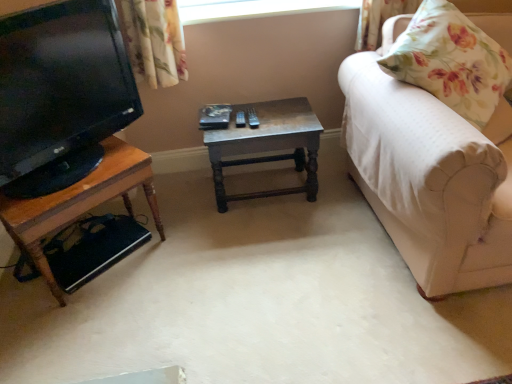
Where is `vacant space situated above woodenobject at left, arranged as the second table when viewed from the right (from a real-world perspective)`? The height and width of the screenshot is (384, 512). vacant space situated above woodenobject at left, arranged as the second table when viewed from the right (from a real-world perspective) is located at coordinates (81, 170).